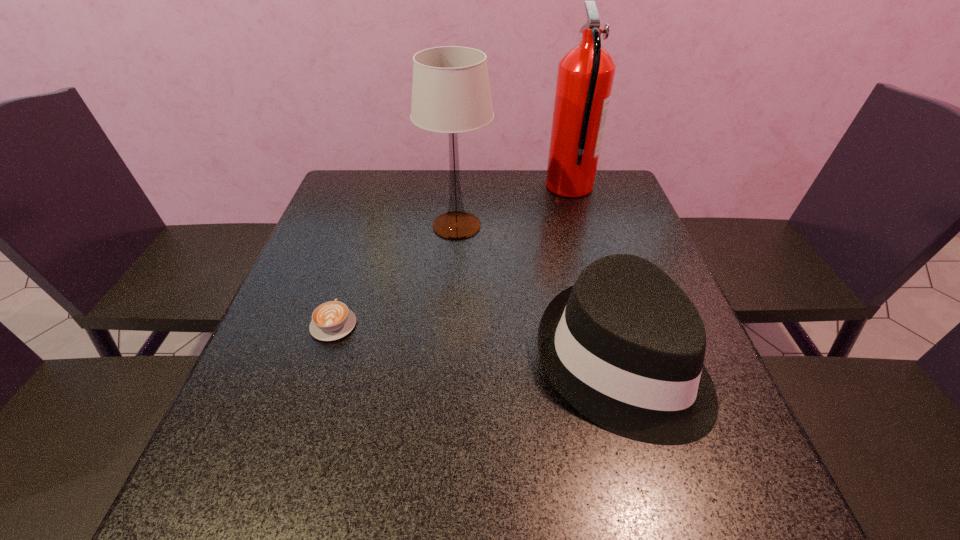
This screenshot has height=540, width=960. Identify the location of vacant point located on the back of the fedora. (589, 255).

Where is `free space located 0.120m on the side of the cappuccino with the handle`? free space located 0.120m on the side of the cappuccino with the handle is located at coordinates click(351, 272).

Locate an element on the screen. The height and width of the screenshot is (540, 960). vacant space located 0.310m on the side of the cappuccino with the handle is located at coordinates (366, 226).

Image resolution: width=960 pixels, height=540 pixels. What are the coordinates of `blank space located on the side of the cappuccino with the handle` in the screenshot? It's located at (366, 228).

Find the location of a particular element. fire extinguisher at the far edge is located at coordinates [585, 76].

Locate an element on the screen. Image resolution: width=960 pixels, height=540 pixels. table lamp at the far edge is located at coordinates (451, 94).

The height and width of the screenshot is (540, 960). I want to click on object that is at the left edge, so coord(332,320).

At what (x,y) coordinates should I click in order to perform the action: click on fire extinguisher located in the right edge section of the desktop. Please return your answer as a coordinate pair (x, y). Image resolution: width=960 pixels, height=540 pixels. Looking at the image, I should click on (585, 76).

You are a GUI agent. You are given a task and a screenshot of the screen. Output one action in this format:
    pyautogui.click(x=<x>, y=<y>)
    Task: Click on the fedora that is positioned at the right edge
    Image resolution: width=960 pixels, height=540 pixels.
    Given the screenshot: What is the action you would take?
    pyautogui.click(x=625, y=346)

Locate an element on the screen. object located at the far right corner is located at coordinates (585, 76).